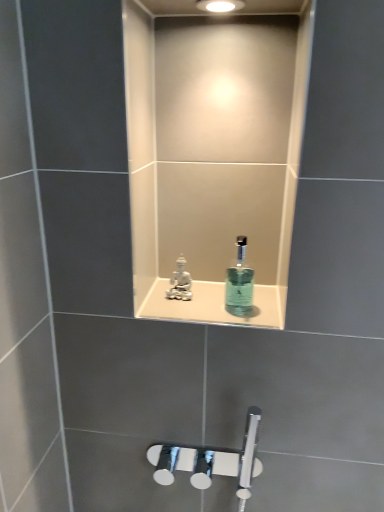
Question: Is white glossy statue at center taller or shorter than translucent glass mouthwash at center?

Choices:
 (A) short
 (B) tall

Answer: (A)

Question: Considering the relative positions of white glossy statue at center and translucent glass mouthwash at center in the image provided, is white glossy statue at center to the left or to the right of translucent glass mouthwash at center?

Choices:
 (A) left
 (B) right

Answer: (A)

Question: Which object is positioned farthest from the white porcelain figurine at center?

Choices:
 (A) translucent glass mouthwash at center
 (B) white glossy statue at center

Answer: (A)

Question: Estimate the real-world distances between objects in this image. Which object is closer to the white porcelain figurine at center?

Choices:
 (A) white glossy statue at center
 (B) translucent glass mouthwash at center

Answer: (A)